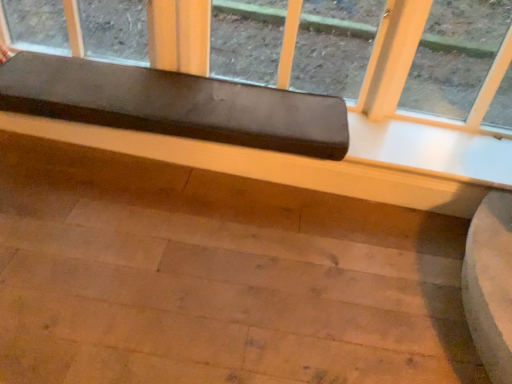
What do you see at coordinates (174, 104) in the screenshot?
I see `matte black cushion at upper center` at bounding box center [174, 104].

This screenshot has height=384, width=512. In order to click on matte black cushion at upper center in this screenshot , I will do `click(174, 104)`.

Where is `matte black cushion at upper center`? Image resolution: width=512 pixels, height=384 pixels. matte black cushion at upper center is located at coordinates (174, 104).